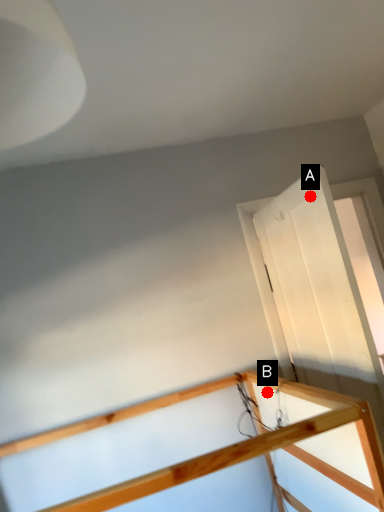
Question: Two points are circled on the image, labeled by A and B beside each circle. Which point appears closest to the camera in this image?

Choices:
 (A) A is closer
 (B) B is closer

Answer: (A)